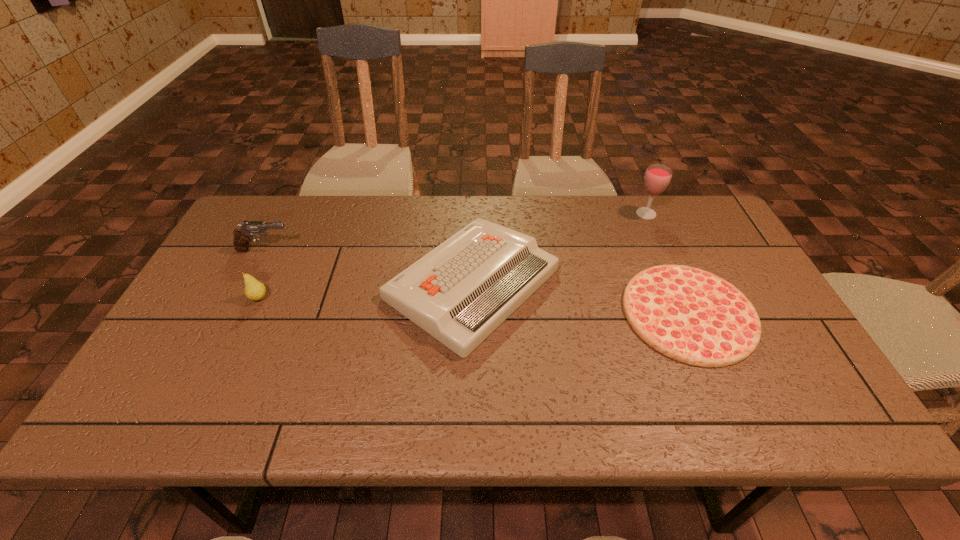
This screenshot has height=540, width=960. Identify the location of wineglass. (657, 177).

Locate an element on the screen. the farthest object is located at coordinates (657, 177).

Identify the location of pistol. The image size is (960, 540). (242, 236).

Locate an element on the screen. This screenshot has height=540, width=960. pear is located at coordinates (254, 290).

The height and width of the screenshot is (540, 960). Find the location of `the fourth tallest object`. the fourth tallest object is located at coordinates (461, 291).

Identify the location of the third object from right to left. Image resolution: width=960 pixels, height=540 pixels. (461, 291).

Where is `pizza`? The image size is (960, 540). pizza is located at coordinates (693, 316).

This screenshot has height=540, width=960. What are the coordinates of `vacant space situated 0.180m on the left of the tallest object` in the screenshot? It's located at (579, 214).

Locate an element on the screen. The height and width of the screenshot is (540, 960). vacant point located at the barrel of the pistol is located at coordinates (365, 250).

Find the location of a particular element. This screenshot has height=540, width=960. vacant space situated 0.060m on the right of the pear is located at coordinates (291, 298).